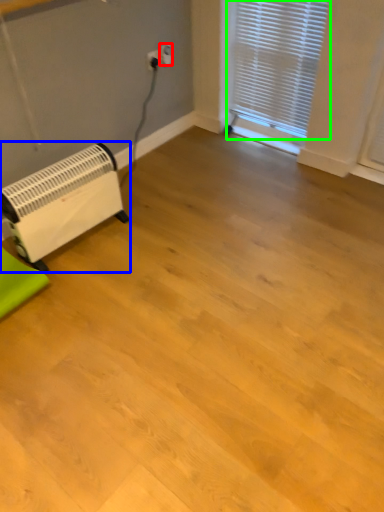
Question: Which is farther away from electric outlet (highlighted by a red box)? appliance (highlighted by a blue box) or window blind (highlighted by a green box)?

Choices:
 (A) appliance
 (B) window blind

Answer: (A)